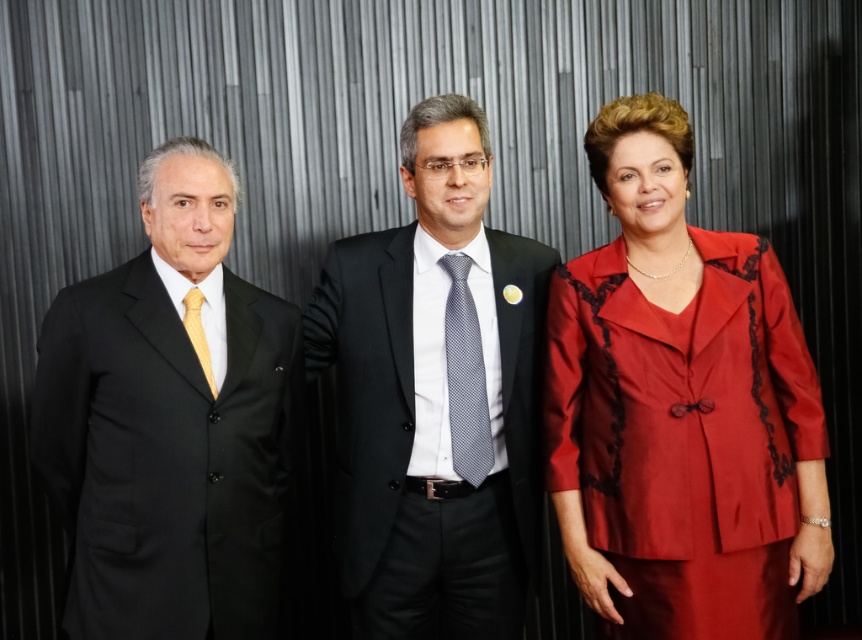
Question: Does gray dotted tie at center appear under matte gold tie at left?

Choices:
 (A) no
 (B) yes

Answer: (B)

Question: Is satin red dress at right above matte gold tie at left?

Choices:
 (A) no
 (B) yes

Answer: (A)

Question: Which object is positioned closest to the matte black suit at center?

Choices:
 (A) satin red dress at right
 (B) black matte suit at left
 (C) gray dotted tie at center

Answer: (C)

Question: Is matte black suit at center to the left of gray dotted tie at center from the viewer's perspective?

Choices:
 (A) yes
 (B) no

Answer: (A)

Question: Which object is the farthest from the black matte suit at left?

Choices:
 (A) gray dotted tie at center
 (B) matte black suit at center
 (C) matte gold tie at left

Answer: (A)

Question: Estimate the real-world distances between objects in this image. Which object is closer to the satin red dress at right?

Choices:
 (A) black matte suit at left
 (B) matte gold tie at left
 (C) matte black suit at center

Answer: (C)